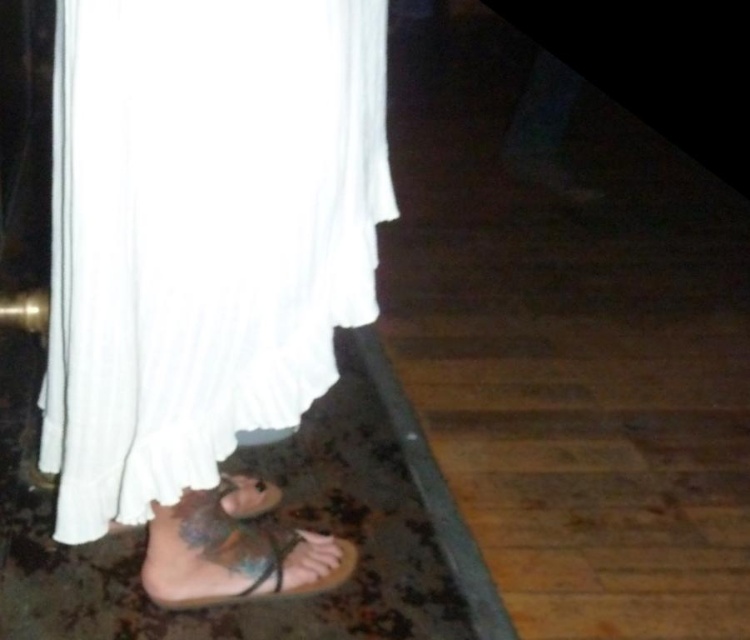
Question: Which of the following is the farthest from the observer?

Choices:
 (A) (188, 531)
 (B) (60, 243)

Answer: (A)

Question: Can you confirm if white cotton dress at lower left is positioned to the right of leather sandal at lower center?

Choices:
 (A) no
 (B) yes

Answer: (A)

Question: Is white cotton dress at lower left below leather sandal at lower center?

Choices:
 (A) yes
 (B) no

Answer: (B)

Question: Which object is farther from the camera taking this photo?

Choices:
 (A) leather sandal at lower center
 (B) white cotton dress at lower left

Answer: (A)

Question: Which point is farther to the camera?

Choices:
 (A) (183, 529)
 (B) (130, 24)

Answer: (A)

Question: Is the position of white cotton dress at lower left less distant than that of leather sandal at lower center?

Choices:
 (A) no
 (B) yes

Answer: (B)